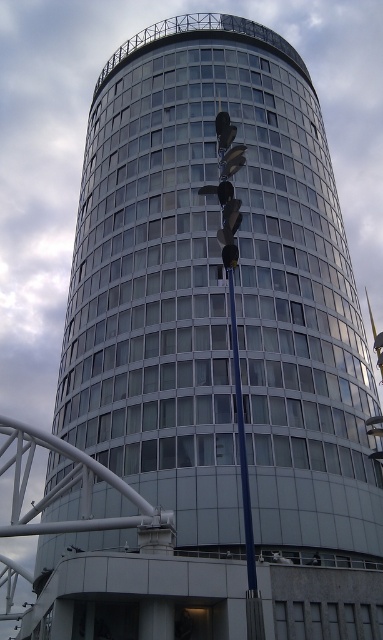
You are standing in front of the modern cylindrical building and see the blue metallic pole at center and the dark blue fabric mannequin at center. Which object is nearer to you?

The blue metallic pole at center is closer to the viewer than the dark blue fabric mannequin at center.

You are standing at the point marked as point (242, 444) in the image. What object is exactly at that location?

The blue metallic pole at center is located at point (242, 444).

You are standing at the entrance of the modern cylindrical building and want to find the blue metallic pole at center. According to the coordinates provided, in which direction should you walk to reach it?

The blue metallic pole at center is located at coordinates point (242, 444). Since the coordinates are in the center, you should walk straight ahead towards the center of the building to reach the blue metallic pole at center.